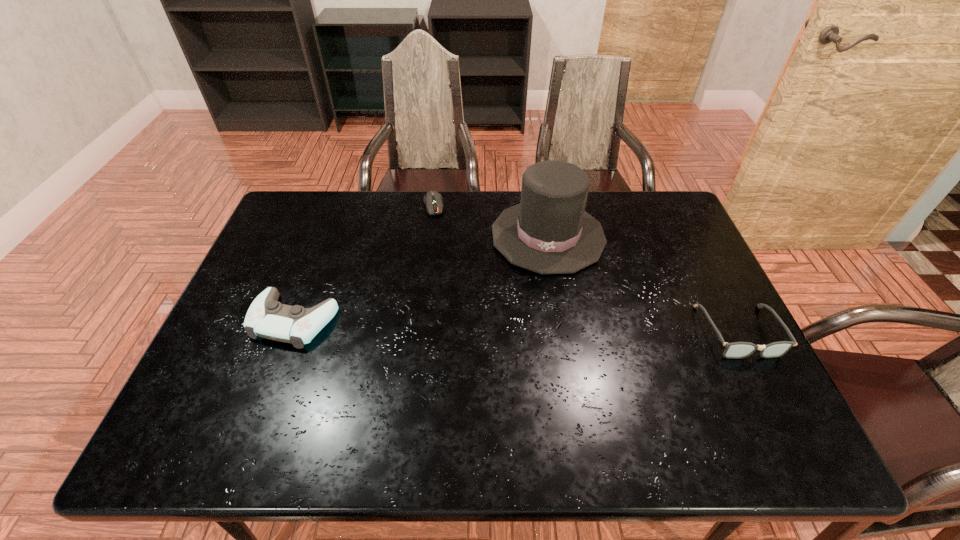
I want to click on blank region between the tallest object and the computer equipment, so click(491, 221).

This screenshot has width=960, height=540. I want to click on free space that is in between the third object from right to left and the control, so click(x=364, y=263).

The height and width of the screenshot is (540, 960). Identify the location of vacant area between the third object from right to left and the dress hat. (491, 221).

Choose which object is the nearest neighbor to the third object from left to right. Please provide its 2D coordinates. Your answer should be formatted as a tuple, i.e. [(x, y)], where the tuple contains the x and y coordinates of a point satisfying the conditions above.

[(433, 200)]

The image size is (960, 540). I want to click on the closest object to the spectacles, so click(x=549, y=232).